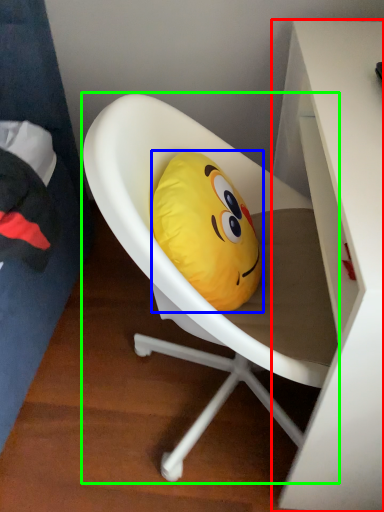
Question: Which object is positioned closest to desk (highlighted by a red box)? Select from pillow (highlighted by a blue box) and chair (highlighted by a green box).

Choices:
 (A) pillow
 (B) chair

Answer: (B)